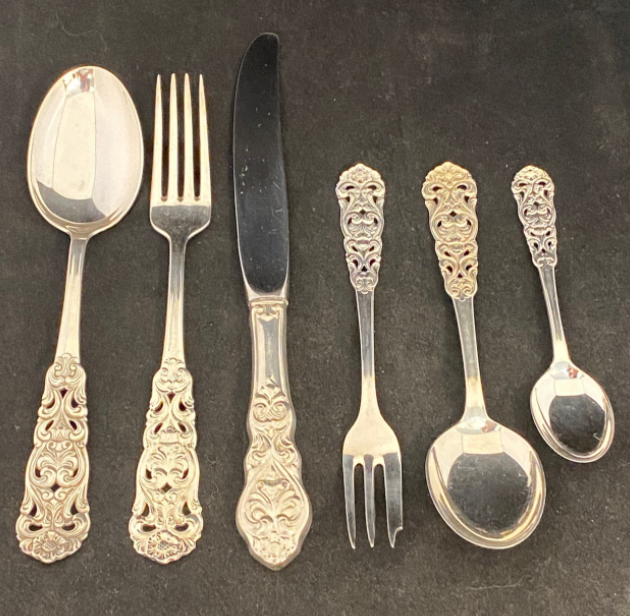
Identify the location of handles. (59, 487), (280, 503), (365, 232), (471, 235), (541, 229).